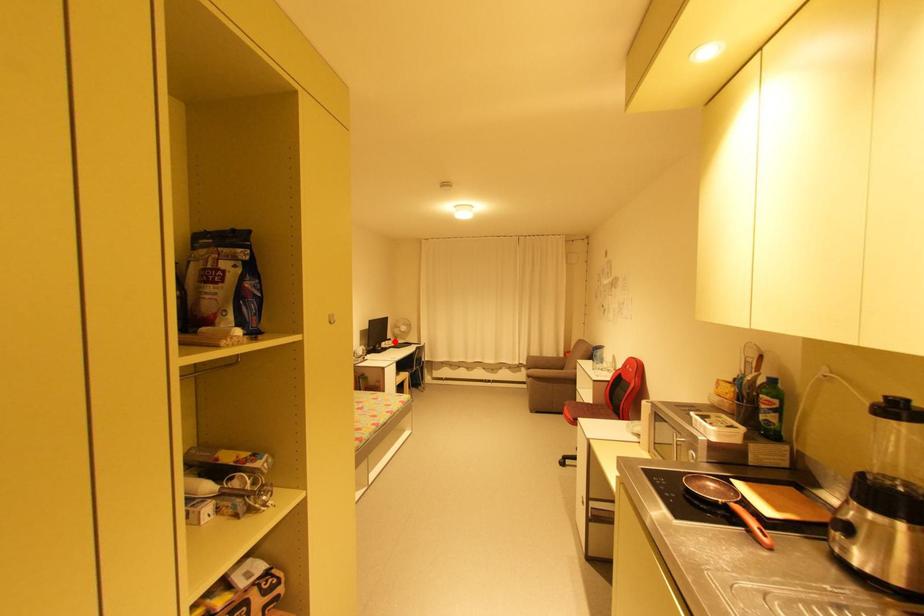
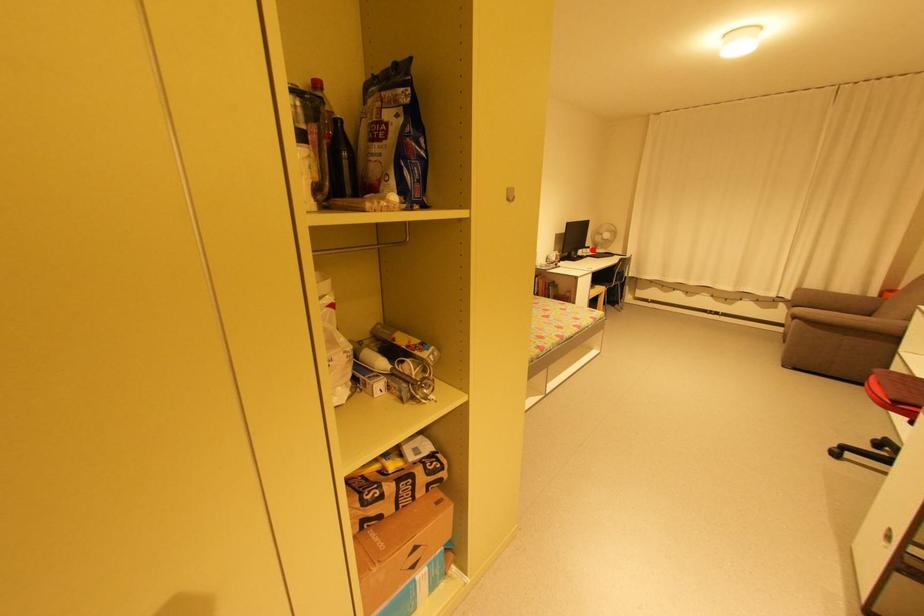
I am providing you with two images of the same scene from different viewpoints. A red point is marked on the first image and another point is marked on the second image. Do the highlighted points in image1 and image2 indicate the same real-world spot?

Yes